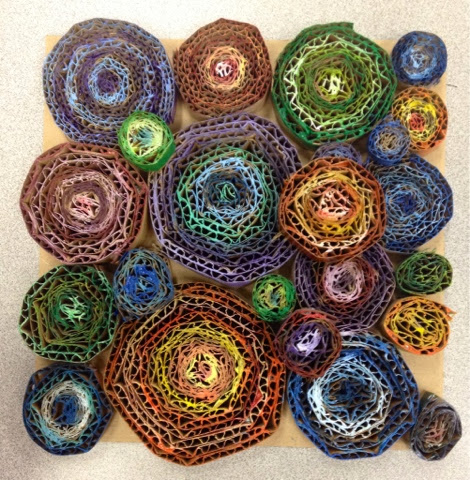
The width and height of the screenshot is (470, 480). I want to click on tan table, so click(x=21, y=115).